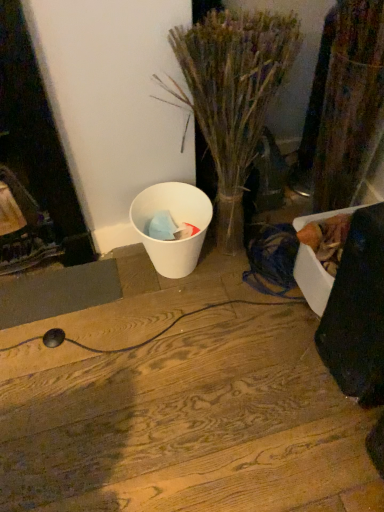
Question: Considering the positions of point (168, 189) and point (193, 99), is point (168, 189) closer or farther from the camera than point (193, 99)?

Choices:
 (A) farther
 (B) closer

Answer: (A)

Question: In the image, is white matte trash can at lower left on the left side or the right side of translucent glass vase at center?

Choices:
 (A) right
 (B) left

Answer: (B)

Question: Which object is positioned closest to the white matte trash can at lower left?

Choices:
 (A) translucent glass vase at center
 (B) wooden floor at center

Answer: (A)

Question: Estimate the real-world distances between objects in this image. Which object is farther from the wooden floor at center?

Choices:
 (A) translucent glass vase at center
 (B) white matte trash can at lower left

Answer: (A)